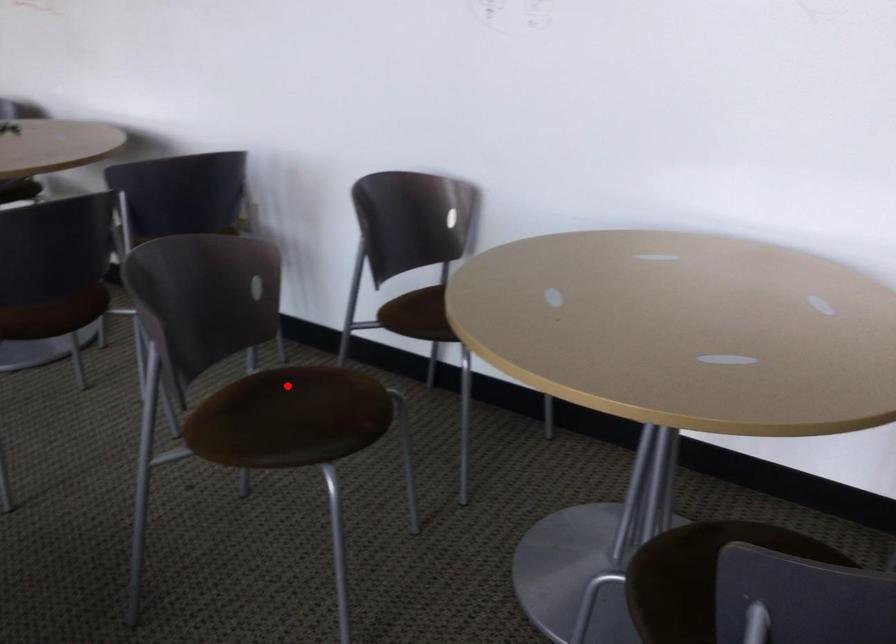
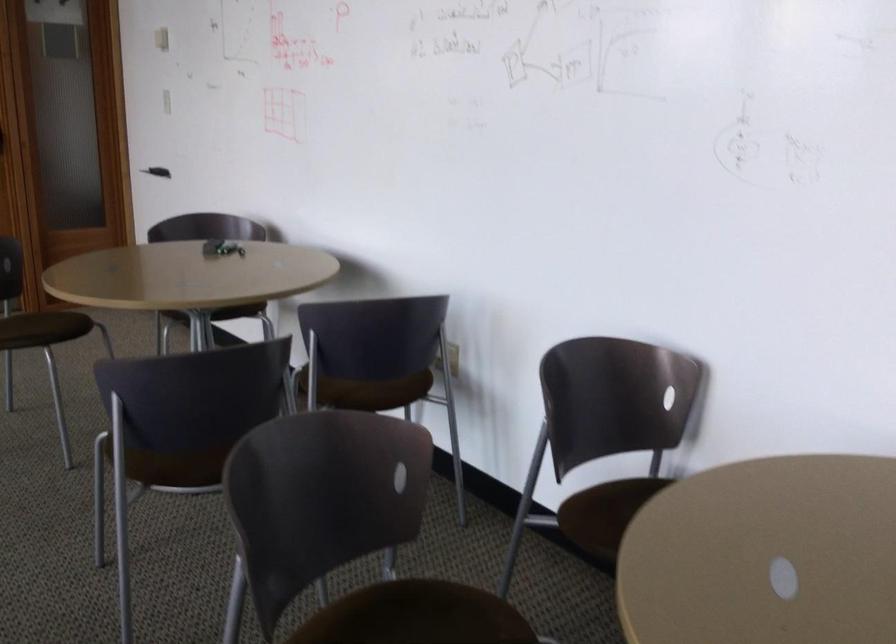
The point at the highlighted location is marked in the first image. Where is the corresponding point in the second image?

(418, 612)